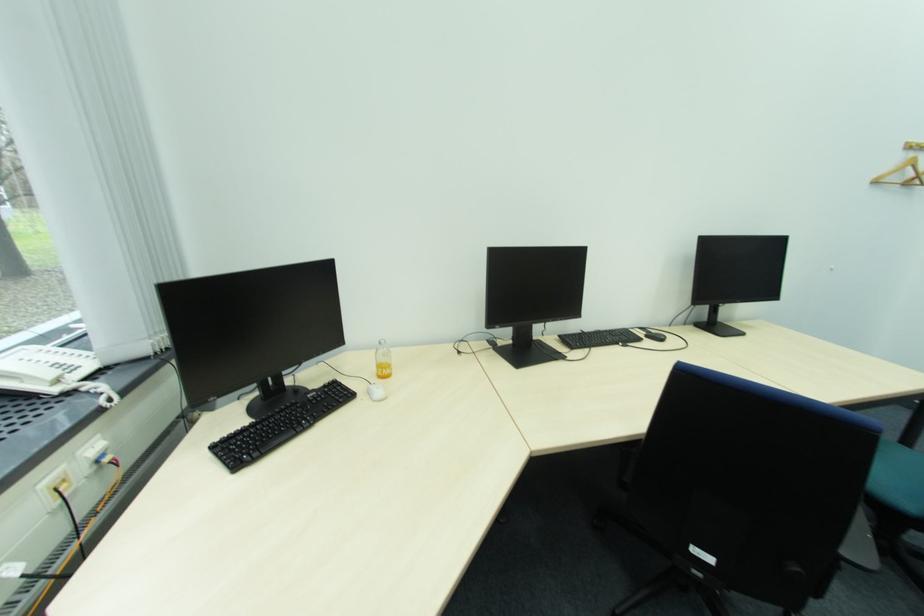
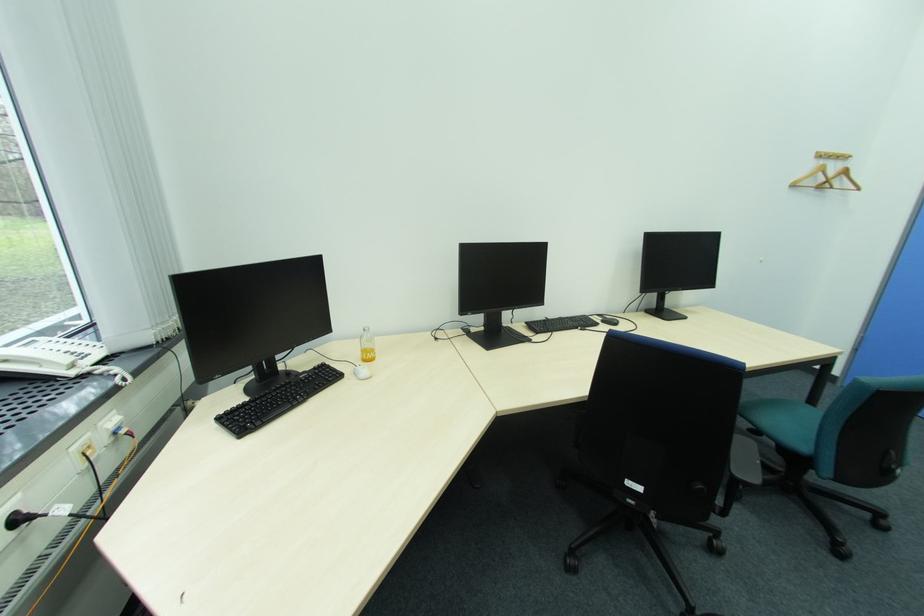
Locate, in the second image, the point that corresponds to [302,403] in the first image.

(297, 383)